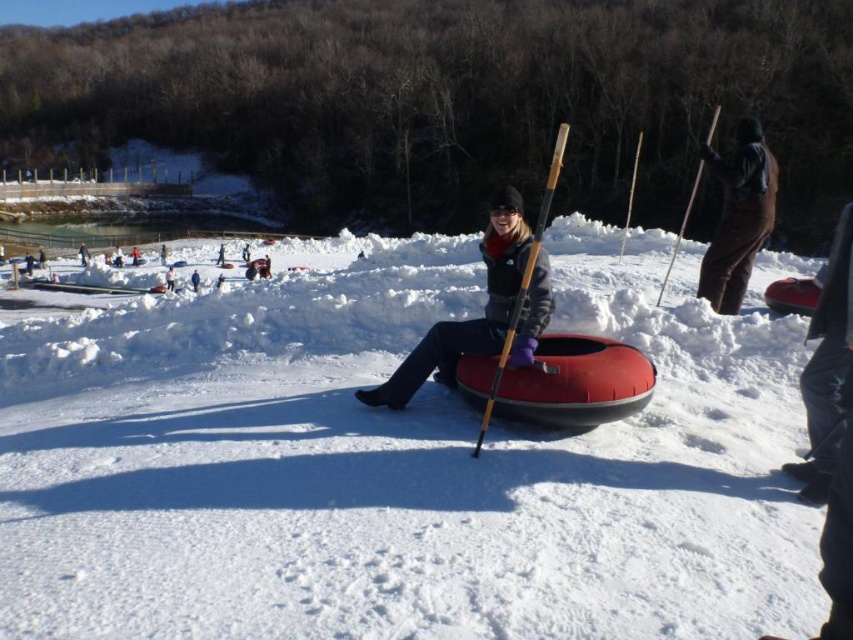
You are standing at the top of the snowy slope and want to slide down on your white snowboard at center. There is a person wearing a matte black jacket at center in front of you. Can you safely slide past them without hitting them?

The matte black jacket at center is located below the white snowboard at center, so you can safely slide past them as the snowboard is higher up and the jacket is positioned lower down.

You are a photographer trying to capture a clear shot of both the brown fuzzy pants at right and the dark gray jacket at center. Since you want both subjects to be visible in the frame, which object should you focus on first to ensure depth of field?

The brown fuzzy pants at right is bigger than the dark gray jacket at center, so focusing on the larger object first will help ensure both are in focus.